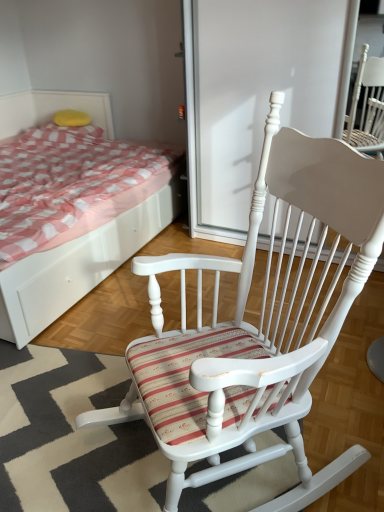
The image size is (384, 512). What do you see at coordinates (71, 118) in the screenshot?
I see `yellow sponge at upper left` at bounding box center [71, 118].

Where is `white wood bed at upper left`? This screenshot has width=384, height=512. white wood bed at upper left is located at coordinates (83, 259).

This screenshot has height=512, width=384. Describe the element at coordinates (256, 93) in the screenshot. I see `white wood screen door at center` at that location.

Describe the element at coordinates (254, 330) in the screenshot. I see `white wood rocking chair at center` at that location.

Identify the location of yellow sponge at upper left. Image resolution: width=384 pixels, height=512 pixels. (71, 118).

Can you confirm if yellow sponge at upper left is shorter than white wood bed at upper left?

Correct, yellow sponge at upper left is not as tall as white wood bed at upper left.

From the image's perspective, is yellow sponge at upper left above white wood bed at upper left?

Correct, yellow sponge at upper left appears higher than white wood bed at upper left in the image.

Considering the relative sizes of yellow sponge at upper left and white wood bed at upper left in the image provided, is yellow sponge at upper left bigger than white wood bed at upper left?

No, yellow sponge at upper left is not bigger than white wood bed at upper left.

From the picture: Is yellow sponge at upper left to the right of white wood bed at upper left from the viewer's perspective?

Yes.

Considering the positions of objects white wood screen door at center and yellow sponge at upper left in the image provided, who is more to the left, white wood screen door at center or yellow sponge at upper left?

yellow sponge at upper left is more to the left.

Could you tell me if white wood screen door at center is facing yellow sponge at upper left?

No, white wood screen door at center is not turned towards yellow sponge at upper left.

From a real-world perspective, relative to white wood screen door at center, is white wood rocking chair at center vertically above or below?

From a real-world perspective, white wood rocking chair at center is physically below white wood screen door at center.

Is the depth of white wood rocking chair at center less than that of white wood screen door at center?

Yes, it is in front of white wood screen door at center.

Which is more to the left, white wood rocking chair at center or white wood screen door at center?

From the viewer's perspective, white wood rocking chair at center appears more on the left side.

From the image's perspective, relative to white wood screen door at center, is white wood rocking chair at center above or below?

Clearly, from the image's perspective, white wood rocking chair at center is below white wood screen door at center.

Based on their sizes in the image, would you say yellow sponge at upper left is bigger or smaller than white wood screen door at center?

Considering their sizes, yellow sponge at upper left takes up less space than white wood screen door at center.

Is yellow sponge at upper left beside white wood screen door at center?

No.

Is the depth of yellow sponge at upper left greater than that of white wood screen door at center?

Yes, yellow sponge at upper left is behind white wood screen door at center.

Is yellow sponge at upper left taller than white wood screen door at center?

In fact, yellow sponge at upper left may be shorter than white wood screen door at center.

Can you see yellow sponge at upper left touching white wood rocking chair at center?

No, yellow sponge at upper left is not touching white wood rocking chair at center.

Could you tell me if yellow sponge at upper left is facing white wood rocking chair at center?

No, yellow sponge at upper left is not oriented towards white wood rocking chair at center.

Considering the relative positions of yellow sponge at upper left and white wood rocking chair at center in the image provided, is yellow sponge at upper left behind white wood rocking chair at center?

Yes, yellow sponge at upper left is further from the viewer.

The image size is (384, 512). I want to click on chair on the right of yellow sponge at upper left, so click(254, 330).

Is white wood bed at upper left not within white wood screen door at center?

Absolutely, white wood bed at upper left is external to white wood screen door at center.

The height and width of the screenshot is (512, 384). Identify the location of bed that is under the white wood screen door at center (from a real-world perspective). (83, 259).

Considering the relative positions of white wood bed at upper left and white wood screen door at center in the image provided, is white wood bed at upper left to the right of white wood screen door at center from the viewer's perspective?

No, white wood bed at upper left is not to the right of white wood screen door at center.

Which of these two, white wood bed at upper left or white wood screen door at center, is wider?

Wider between the two is white wood bed at upper left.

Considering the sizes of white wood rocking chair at center and yellow sponge at upper left in the image, is white wood rocking chair at center wider or thinner than yellow sponge at upper left?

Clearly, white wood rocking chair at center has more width compared to yellow sponge at upper left.

Which point is more distant from viewer, [169,502] or [76,114]?

The point [76,114] is behind.

From the picture: Is white wood rocking chair at center to the left of yellow sponge at upper left from the viewer's perspective?

Incorrect, white wood rocking chair at center is not on the left side of yellow sponge at upper left.

Between white wood rocking chair at center and yellow sponge at upper left, which one has more height?

Standing taller between the two is white wood rocking chair at center.

Locate an element on the screen. pillow on the right of white wood bed at upper left is located at coordinates (71, 118).

The width and height of the screenshot is (384, 512). Find the location of `screen door in front of the yellow sponge at upper left`. screen door in front of the yellow sponge at upper left is located at coordinates (256, 93).

Estimate the real-world distances between objects in this image. Which object is closer to white wood rocking chair at center, white wood bed at upper left or white wood screen door at center?

Based on the image, white wood bed at upper left appears to be nearer to white wood rocking chair at center.

Based on their spatial positions, is white wood screen door at center or yellow sponge at upper left further from white wood rocking chair at center?

yellow sponge at upper left.

In the scene shown: Based on their spatial positions, is white wood bed at upper left or yellow sponge at upper left further from white wood screen door at center?

yellow sponge at upper left is positioned further to the anchor white wood screen door at center.

From the picture: Estimate the real-world distances between objects in this image. Which object is further from white wood bed at upper left, yellow sponge at upper left or white wood rocking chair at center?

yellow sponge at upper left lies further to white wood bed at upper left than the other object.

Considering their positions, is yellow sponge at upper left positioned further to white wood screen door at center than white wood bed at upper left?

yellow sponge at upper left.

Estimate the real-world distances between objects in this image. Which object is further from white wood rocking chair at center, yellow sponge at upper left or white wood screen door at center?

yellow sponge at upper left is positioned further to the anchor white wood rocking chair at center.

Based on their spatial positions, is white wood bed at upper left or white wood rocking chair at center closer to white wood screen door at center?

white wood bed at upper left is closer to white wood screen door at center.

Considering their positions, is white wood rocking chair at center positioned further to white wood screen door at center than white wood bed at upper left?

white wood rocking chair at center is positioned further to the anchor white wood screen door at center.

Where is `bed between white wood rocking chair at center and yellow sponge at upper left in the front-back direction`? The image size is (384, 512). bed between white wood rocking chair at center and yellow sponge at upper left in the front-back direction is located at coordinates (83, 259).

Where is `screen door between white wood rocking chair at center and yellow sponge at upper left along the z-axis`? The image size is (384, 512). screen door between white wood rocking chair at center and yellow sponge at upper left along the z-axis is located at coordinates (256, 93).

Locate an element on the screen. This screenshot has width=384, height=512. screen door positioned between white wood bed at upper left and yellow sponge at upper left from near to far is located at coordinates (256, 93).

Find the location of a particular element. chair between white wood bed at upper left and white wood screen door at center in the horizontal direction is located at coordinates (254, 330).